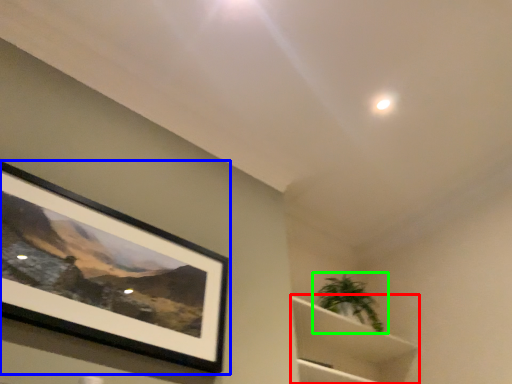
Question: Which object is the closest to the cabinet (highlighted by a red box)? Choose among these: picture frame (highlighted by a blue box) or houseplant (highlighted by a green box).

Choices:
 (A) picture frame
 (B) houseplant

Answer: (B)